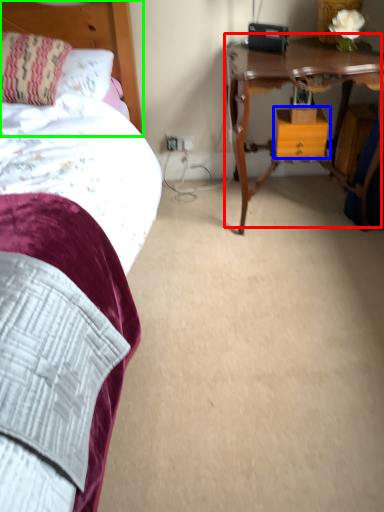
Question: Which is nearer to the table (highlighted by a red box)? nightstand (highlighted by a blue box) or headboard (highlighted by a green box).

Choices:
 (A) nightstand
 (B) headboard

Answer: (A)